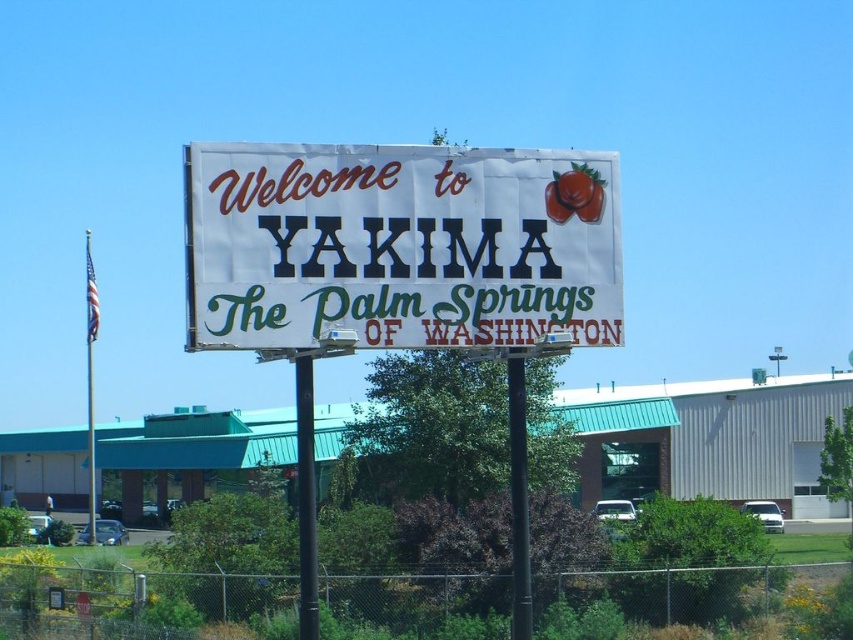
Who is positioned more to the left, white paper sign at center or white plastic street sign at center?

white paper sign at center is more to the left.

Between point (340, 173) and point (776, 358), which one is positioned behind?

Positioned behind is point (776, 358).

Locate an element on the screen. The height and width of the screenshot is (640, 853). white paper sign at center is located at coordinates (399, 246).

Which of these two, metallic pole at center or white plastic street sign at center, stands taller?

metallic pole at center is taller.

Is metallic pole at center to the right of white plastic street sign at center from the viewer's perspective?

Incorrect, metallic pole at center is not on the right side of white plastic street sign at center.

Who is more distant from viewer, [310,563] or [773,356]?

Positioned behind is point [773,356].

Locate an element on the screen. Image resolution: width=853 pixels, height=640 pixels. metallic pole at center is located at coordinates click(x=306, y=499).

Who is higher up, black metal pole at center or white plastic street sign at center?

black metal pole at center is higher up.

Which is in front, point (518, 444) or point (772, 355)?

Positioned in front is point (518, 444).

You are a GUI agent. You are given a task and a screenshot of the screen. Output one action in this format:
    pyautogui.click(x=<x>, y=<y>)
    Task: Click on the black metal pole at center
    The height and width of the screenshot is (640, 853).
    Given the screenshot: What is the action you would take?
    pyautogui.click(x=518, y=497)